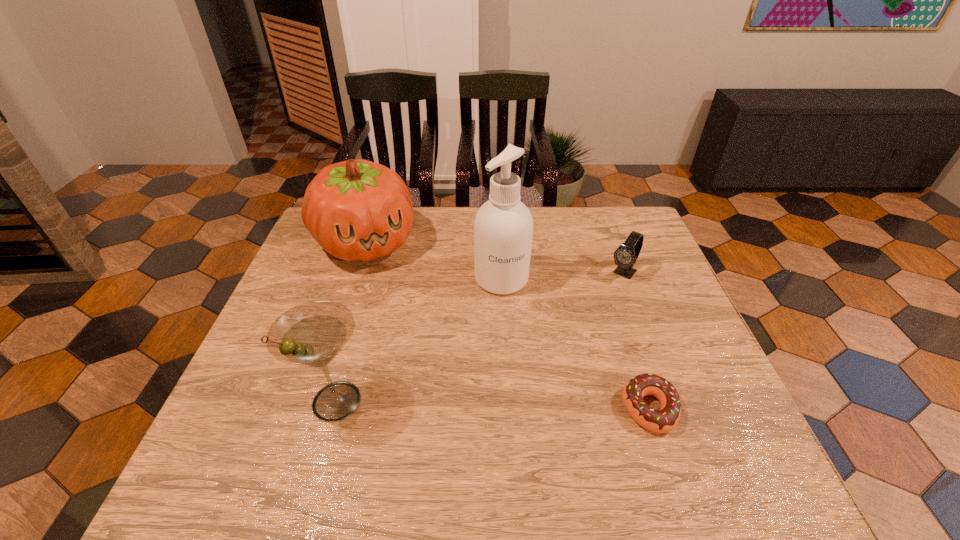
Locate an element on the screen. The height and width of the screenshot is (540, 960). martini that is positioned at the left edge is located at coordinates (312, 334).

Locate an element on the screen. The image size is (960, 540). pumpkin present at the left edge is located at coordinates (357, 210).

The width and height of the screenshot is (960, 540). What are the coordinates of `doughnut that is at the right edge` in the screenshot? It's located at (664, 420).

Where is `watch situated at the right edge`? watch situated at the right edge is located at coordinates (625, 256).

Where is `object that is at the far left corner`? Image resolution: width=960 pixels, height=540 pixels. object that is at the far left corner is located at coordinates click(357, 210).

The image size is (960, 540). In order to click on object located at the near left corner in this screenshot , I will do `click(312, 334)`.

Where is `object at the near right corner`? The width and height of the screenshot is (960, 540). object at the near right corner is located at coordinates (664, 420).

Where is `vacant space at the far edge of the desktop`? This screenshot has width=960, height=540. vacant space at the far edge of the desktop is located at coordinates tap(564, 249).

I want to click on vacant area at the near edge of the desktop, so click(x=436, y=430).

Locate an element on the screen. This screenshot has width=960, height=540. vacant space at the left edge of the desktop is located at coordinates (233, 398).